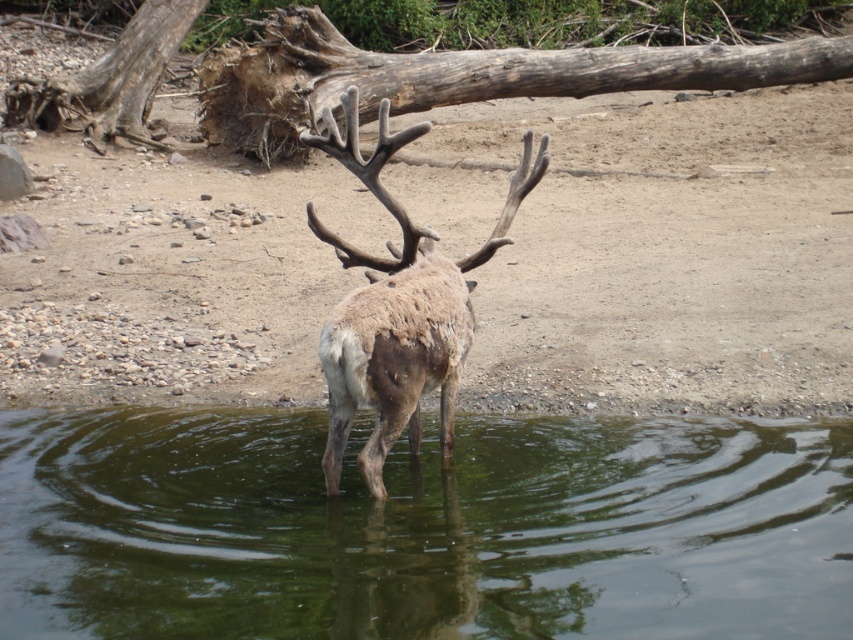
You are standing at the edge of the shoreline and see the large deer in the shallow water. There is a point marked at coordinates point (422, 529). What does this point represent in the scene?

The point (422, 529) represents the location of the green reflective water at center.

You are a photographer trying to capture the brown fuzzy antlered deer at center. To get a clear reflection of its antlers in the green reflective water at center, where should you position yourself relative to the deer?

The green reflective water at center is located below the brown fuzzy antlered deer at center, so you should position yourself directly in front of the deer at the same level as the water to capture the reflection of its antlers.